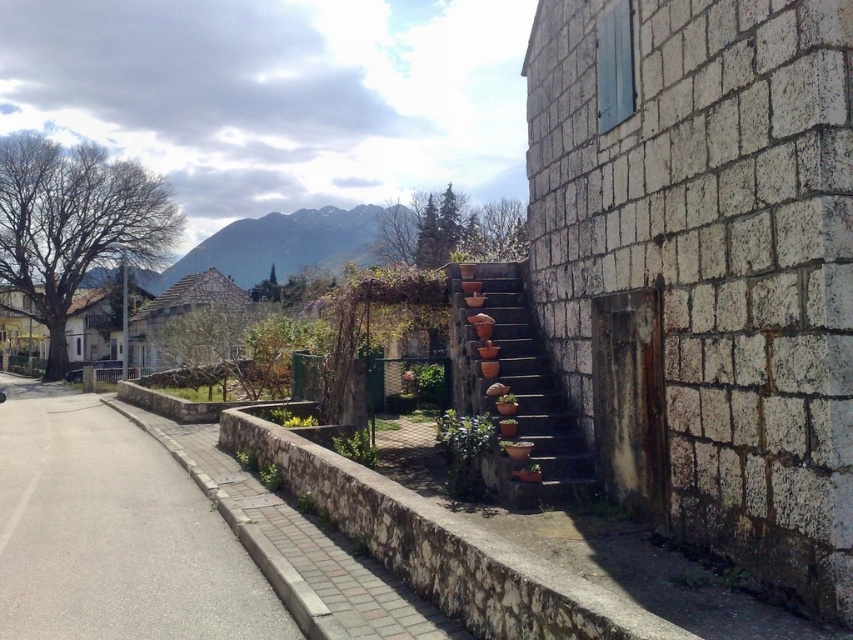
Question: Considering the real-world distances, which object is farthest from the white stone wall at right?

Choices:
 (A) terracotta clay pots at center
 (B) gray asphalt pavement at lower left

Answer: (B)

Question: Which object appears closest to the camera in this image?

Choices:
 (A) gray asphalt pavement at lower left
 (B) terracotta clay pots at center

Answer: (A)

Question: Where is white stone wall at right located in relation to terracotta clay pots at center in the image?

Choices:
 (A) left
 (B) right

Answer: (B)

Question: Does white stone wall at right appear under terracotta clay pots at center?

Choices:
 (A) yes
 (B) no

Answer: (B)

Question: Among these points, which one is farthest from the camera?

Choices:
 (A) pyautogui.click(x=451, y=273)
 (B) pyautogui.click(x=595, y=19)
 (C) pyautogui.click(x=180, y=602)

Answer: (A)

Question: Is gray asphalt pavement at lower left positioned at the back of terracotta clay pots at center?

Choices:
 (A) yes
 (B) no

Answer: (B)